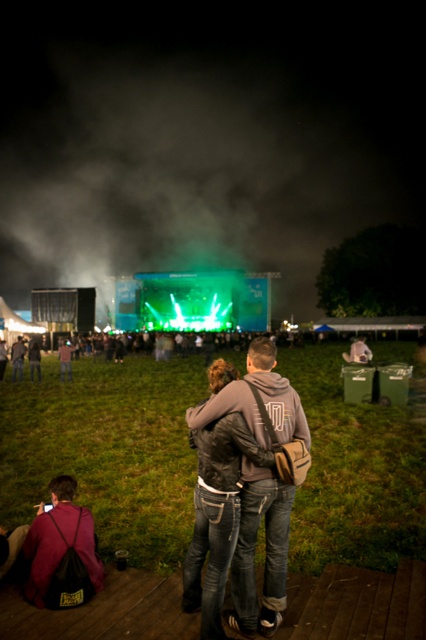
You are standing in the concert venue and want to take a photo of both the stage and the couple. You notice two points marked in the image. The first point is at coordinate point(262, 468) and the second is at point(71, 506). Based on their positions, which point should you focus on first to ensure both subjects are in clear view?

Point(262, 468) is closer to the camera than point(71, 506), so focusing on point(262, 468) first will ensure both subjects are in clear view.

You are a photographer at the concert and want to capture a photo of the maroon fabric jacket at lower left and the dark gray hoodie at center. Based on their positions, which one is more to the left?

The dark gray hoodie at center is more to the left because the maroon fabric jacket at lower left is positioned on the right side of it.

You are a photographer at the concert trying to capture a clear photo of the stage. There are two people in front of you wearing a denim jacket at center and a dark gray hoodie at center. Which person should you ask to move so that you can get a better view of the stage?

You should ask the denim jacket at center to move because they are in front of the dark gray hoodie at center, making them closer to your position and blocking the view.